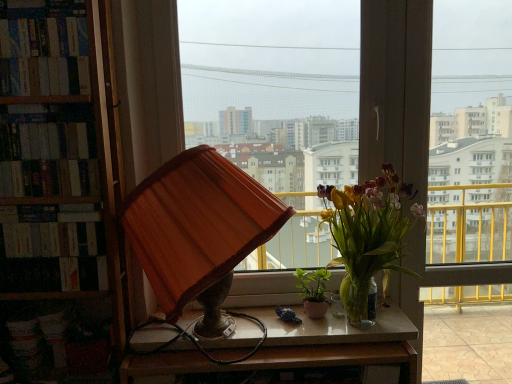
Question: Is green matte plant at center, marked as the 1th houseplant in a left-to-right arrangement, positioned beyond the bounds of matte wooden lampshade at center, the 1th window positioned from the left?

Choices:
 (A) no
 (B) yes

Answer: (B)

Question: Considering the relative sizes of green matte plant at center, which is the 2th houseplant from right to left, and matte wooden lampshade at center, the 1th window positioned from the left, in the image provided, is green matte plant at center, which is the 2th houseplant from right to left, smaller than matte wooden lampshade at center, the 1th window positioned from the left,?

Choices:
 (A) no
 (B) yes

Answer: (B)

Question: Is the depth of green matte plant at center, marked as the 1th houseplant in a left-to-right arrangement, less than that of matte wooden lampshade at center, the 1th window positioned from the left?

Choices:
 (A) yes
 (B) no

Answer: (B)

Question: From a real-world perspective, is green matte plant at center, which is the 2th houseplant from right to left, positioned over matte wooden lampshade at center, the 1th window positioned from the left, based on gravity?

Choices:
 (A) yes
 (B) no

Answer: (B)

Question: From the image's perspective, is green matte plant at center, which is the 2th houseplant from right to left, under matte wooden lampshade at center, the 1th window positioned from the left?

Choices:
 (A) yes
 (B) no

Answer: (A)

Question: Considering the relative sizes of green matte plant at center, which is the 2th houseplant from right to left, and matte wooden lampshade at center, the 1th window positioned from the left, in the image provided, is green matte plant at center, which is the 2th houseplant from right to left, shorter than matte wooden lampshade at center, the 1th window positioned from the left,?

Choices:
 (A) yes
 (B) no

Answer: (A)

Question: Does matte wooden lampshade at center, the 1th window positioned from the left, come behind wooden desk at center?

Choices:
 (A) yes
 (B) no

Answer: (A)

Question: Is matte wooden lampshade at center, the second window positioned from the right, aimed at wooden desk at center?

Choices:
 (A) yes
 (B) no

Answer: (A)

Question: Is matte wooden lampshade at center, the second window positioned from the right, to the right of wooden desk at center from the viewer's perspective?

Choices:
 (A) no
 (B) yes

Answer: (B)

Question: Can you confirm if matte wooden lampshade at center, the 1th window positioned from the left, is thinner than wooden desk at center?

Choices:
 (A) yes
 (B) no

Answer: (A)

Question: From the image's perspective, would you say matte wooden lampshade at center, the 1th window positioned from the left, is shown under wooden desk at center?

Choices:
 (A) no
 (B) yes

Answer: (A)

Question: Is matte wooden lampshade at center, the second window positioned from the right, at the left side of wooden desk at center?

Choices:
 (A) no
 (B) yes

Answer: (A)

Question: Does hardcover book at left, which appears as the first book when ordered from the bottom, have a smaller size compared to transparent glass window at center, which is the 1th window from right to left?

Choices:
 (A) yes
 (B) no

Answer: (A)